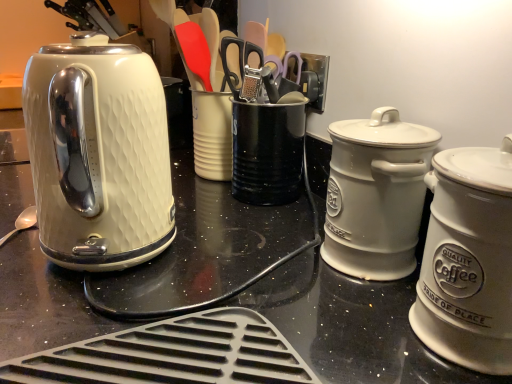
You are a GUI agent. You are given a task and a screenshot of the screen. Output one action in this format:
    pyautogui.click(x=<x>, y=<y>)
    Task: Click on the matte white kettle at left
    Image resolution: width=512 pixels, height=384 pixels.
    Given the screenshot: What is the action you would take?
    pyautogui.click(x=98, y=153)

Image resolution: width=512 pixels, height=384 pixels. What do you see at coordinates (22, 223) in the screenshot?
I see `silver metallic spoon at lower left` at bounding box center [22, 223].

The image size is (512, 384). In order to click on matte white kettle at left in this screenshot , I will do `click(98, 153)`.

Is matte white kettle at left looking in the opposite direction of white ceramic canister at right, the first kitchen appliance in the back-to-front sequence?

→ That's right, matte white kettle at left is facing away from white ceramic canister at right, the first kitchen appliance in the back-to-front sequence.

From a real-world perspective, who is located higher, matte white kettle at left or white ceramic canister at right, the second kitchen appliance in the front-to-back sequence?

From a 3D spatial view, matte white kettle at left is above.

Based on the photo, in terms of size, does matte white kettle at left appear bigger or smaller than white ceramic canister at right, the second kitchen appliance in the front-to-back sequence?

In the image, matte white kettle at left appears to be larger than white ceramic canister at right, the second kitchen appliance in the front-to-back sequence.

From the image's perspective, which is below, matte white kettle at left or white ceramic canister at right, the first kitchen appliance in the back-to-front sequence?

From the image's view, white ceramic canister at right, the first kitchen appliance in the back-to-front sequence, is below.

From a real-world perspective, is black metal canister at center physically above white ceramic canister at right, the first kitchen appliance in the back-to-front sequence?

No, from a real-world perspective, black metal canister at center is not on top of white ceramic canister at right, the first kitchen appliance in the back-to-front sequence.

Is black metal canister at center at the right side of white ceramic canister at right, the second kitchen appliance in the front-to-back sequence?

No.

Are black metal canister at center and white ceramic canister at right, the second kitchen appliance in the front-to-back sequence, located far from each other?

No, black metal canister at center is not far away from white ceramic canister at right, the second kitchen appliance in the front-to-back sequence.

Looking at this image, considering the relative sizes of black metal canister at center and white ceramic canister at right, the first kitchen appliance in the back-to-front sequence, in the image provided, is black metal canister at center taller than white ceramic canister at right, the first kitchen appliance in the back-to-front sequence,?

Incorrect, the height of black metal canister at center is not larger of that of white ceramic canister at right, the first kitchen appliance in the back-to-front sequence.

Based on their sizes in the image, would you say black metal canister at center is bigger or smaller than white ceramic canister at right, which is counted as the 2th kitchen appliance, starting from the back?

Clearly, black metal canister at center is larger in size than white ceramic canister at right, which is counted as the 2th kitchen appliance, starting from the back.

Is white ceramic canister at right, marked as the first kitchen appliance in a front-to-back arrangement, at the back of black metal canister at center?

No, black metal canister at center's orientation is not away from white ceramic canister at right, marked as the first kitchen appliance in a front-to-back arrangement.

Based on the photo, from a real-world perspective, between black metal canister at center and white ceramic canister at right, marked as the first kitchen appliance in a front-to-back arrangement, who is vertically higher?

In real-world perspective, white ceramic canister at right, marked as the first kitchen appliance in a front-to-back arrangement, is above.

Is the position of white ceramic canister at right, which is counted as the 2th kitchen appliance, starting from the back, more distant than that of silver metallic spoon at lower left?

No, it is in front of silver metallic spoon at lower left.

Considering the sizes of objects white ceramic canister at right, which is counted as the 2th kitchen appliance, starting from the back, and silver metallic spoon at lower left in the image provided, who is thinner, white ceramic canister at right, which is counted as the 2th kitchen appliance, starting from the back, or silver metallic spoon at lower left?

silver metallic spoon at lower left is thinner.

Which is in front, point (505, 214) or point (28, 212)?

Positioned in front is point (505, 214).

From their relative heights in the image, would you say white ceramic canister at right, which is counted as the 2th kitchen appliance, starting from the back, is taller or shorter than silver metallic spoon at lower left?

Clearly, white ceramic canister at right, which is counted as the 2th kitchen appliance, starting from the back, is taller compared to silver metallic spoon at lower left.

Considering their positions, is matte white kettle at left located in front of or behind black metal canister at center?

In the image, matte white kettle at left appears in front of black metal canister at center.

Considering the sizes of objects matte white kettle at left and black metal canister at center in the image provided, who is taller, matte white kettle at left or black metal canister at center?

matte white kettle at left.

Considering the relative sizes of matte white kettle at left and black metal canister at center in the image provided, is matte white kettle at left smaller than black metal canister at center?

No, matte white kettle at left is not smaller than black metal canister at center.

Is matte white kettle at left directly adjacent to black metal canister at center?

matte white kettle at left and black metal canister at center are not in contact.

Is white ceramic canister at right, the first kitchen appliance in the back-to-front sequence, aimed at black metal canister at center?

No, white ceramic canister at right, the first kitchen appliance in the back-to-front sequence, is not oriented towards black metal canister at center.

Can you confirm if white ceramic canister at right, the first kitchen appliance in the back-to-front sequence, is bigger than black metal canister at center?

No, white ceramic canister at right, the first kitchen appliance in the back-to-front sequence, is not bigger than black metal canister at center.

Looking at this image, from the image's perspective, is white ceramic canister at right, the first kitchen appliance in the back-to-front sequence, located above black metal canister at center?

No, from the image's perspective, white ceramic canister at right, the first kitchen appliance in the back-to-front sequence, is not above black metal canister at center.

Considering the positions of objects white ceramic canister at right, the second kitchen appliance in the front-to-back sequence, and black metal canister at center in the image provided, who is in front, white ceramic canister at right, the second kitchen appliance in the front-to-back sequence, or black metal canister at center?

white ceramic canister at right, the second kitchen appliance in the front-to-back sequence, is in front.

From the image's perspective, is white ceramic canister at right, the second kitchen appliance in the front-to-back sequence, below silver metallic spoon at lower left?

Incorrect, from the image's perspective, white ceramic canister at right, the second kitchen appliance in the front-to-back sequence, is higher than silver metallic spoon at lower left.

Between white ceramic canister at right, the first kitchen appliance in the back-to-front sequence, and silver metallic spoon at lower left, which one has more height?

With more height is white ceramic canister at right, the first kitchen appliance in the back-to-front sequence.

Which object is wider, white ceramic canister at right, the second kitchen appliance in the front-to-back sequence, or silver metallic spoon at lower left?

Wider between the two is white ceramic canister at right, the second kitchen appliance in the front-to-back sequence.

In terms of size, does white ceramic canister at right, the second kitchen appliance in the front-to-back sequence, appear bigger or smaller than silver metallic spoon at lower left?

In the image, white ceramic canister at right, the second kitchen appliance in the front-to-back sequence, appears to be larger than silver metallic spoon at lower left.

The width and height of the screenshot is (512, 384). Identify the location of kitchen appliance behind the matte white kettle at left. (376, 195).

The width and height of the screenshot is (512, 384). What are the coordinates of `appliance that is above the white ceramic canister at right, the second kitchen appliance in the front-to-back sequence (from the image's perspective)` in the screenshot? It's located at (267, 152).

Based on their spatial positions, is black metal canister at center or white ceramic canister at right, marked as the first kitchen appliance in a front-to-back arrangement, closer to white ceramic canister at right, the second kitchen appliance in the front-to-back sequence?

white ceramic canister at right, marked as the first kitchen appliance in a front-to-back arrangement, is closer to white ceramic canister at right, the second kitchen appliance in the front-to-back sequence.

Which object lies nearer to the anchor point white ceramic canister at right, marked as the first kitchen appliance in a front-to-back arrangement, white ceramic canister at right, the second kitchen appliance in the front-to-back sequence, or black metal canister at center?

white ceramic canister at right, the second kitchen appliance in the front-to-back sequence.

Looking at the image, which one is located further to black metal canister at center, silver metallic spoon at lower left or white ceramic canister at right, the first kitchen appliance in the back-to-front sequence?

silver metallic spoon at lower left lies further to black metal canister at center than the other object.

Which object lies nearer to the anchor point black metal canister at center, matte white kettle at left or silver metallic spoon at lower left?

matte white kettle at left lies closer to black metal canister at center than the other object.

Considering their positions, is matte white kettle at left positioned further to white ceramic canister at right, the second kitchen appliance in the front-to-back sequence, than white ceramic canister at right, marked as the first kitchen appliance in a front-to-back arrangement?

Among the two, matte white kettle at left is located further to white ceramic canister at right, the second kitchen appliance in the front-to-back sequence.

Considering their positions, is black metal canister at center positioned further to silver metallic spoon at lower left than white ceramic canister at right, the second kitchen appliance in the front-to-back sequence?

Among the two, white ceramic canister at right, the second kitchen appliance in the front-to-back sequence, is located further to silver metallic spoon at lower left.

Based on the photo, estimate the real-world distances between objects in this image. Which object is closer to silver metallic spoon at lower left, matte white kettle at left or black metal canister at center?

matte white kettle at left is positioned closer to the anchor silver metallic spoon at lower left.

Estimate the real-world distances between objects in this image. Which object is further from silver metallic spoon at lower left, white ceramic canister at right, the first kitchen appliance in the back-to-front sequence, or black metal canister at center?

Among the two, white ceramic canister at right, the first kitchen appliance in the back-to-front sequence, is located further to silver metallic spoon at lower left.

Where is `kitchen appliance between matte white kettle at left and white ceramic canister at right, marked as the first kitchen appliance in a front-to-back arrangement`? This screenshot has width=512, height=384. kitchen appliance between matte white kettle at left and white ceramic canister at right, marked as the first kitchen appliance in a front-to-back arrangement is located at coordinates (376, 195).

At what (x,y) coordinates should I click in order to perform the action: click on kitchen appliance between silver metallic spoon at lower left and white ceramic canister at right, marked as the first kitchen appliance in a front-to-back arrangement. Please return your answer as a coordinate pair (x, y). Looking at the image, I should click on (376, 195).

Locate an element on the screen. This screenshot has width=512, height=384. kettle between silver metallic spoon at lower left and white ceramic canister at right, marked as the first kitchen appliance in a front-to-back arrangement is located at coordinates (98, 153).

At what (x,y) coordinates should I click in order to perform the action: click on kettle between silver metallic spoon at lower left and black metal canister at center in the horizontal direction. Please return your answer as a coordinate pair (x, y). This screenshot has height=384, width=512. Looking at the image, I should click on point(98,153).